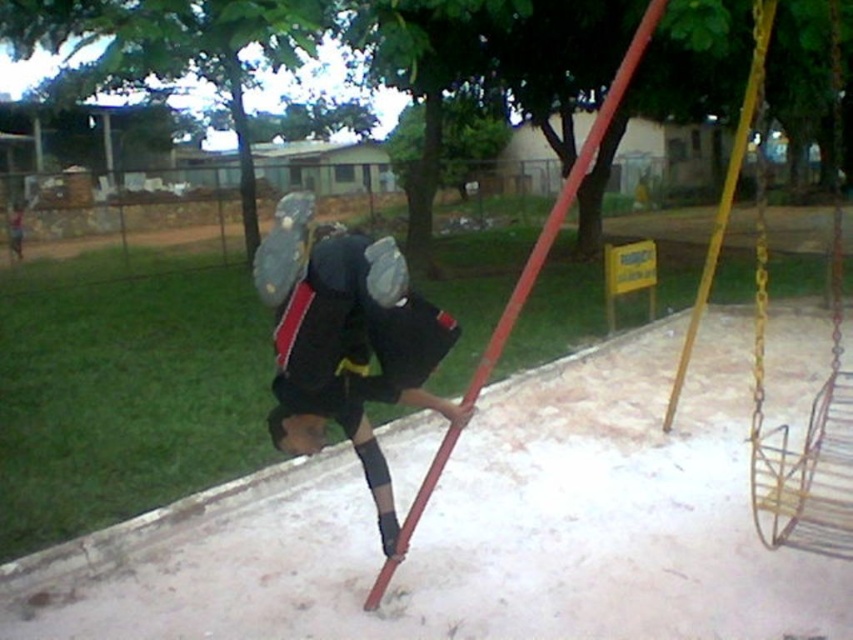
Is black matte uniform at center below metallic chain swing at right?

Yes, black matte uniform at center is below metallic chain swing at right.

Between point (315, 378) and point (827, 484), which one is positioned behind?

Point (827, 484)

Is point (389, 506) closer to camera compared to point (756, 396)?

Yes.

Find the location of a particular element. This screenshot has width=853, height=640. black matte uniform at center is located at coordinates (345, 340).